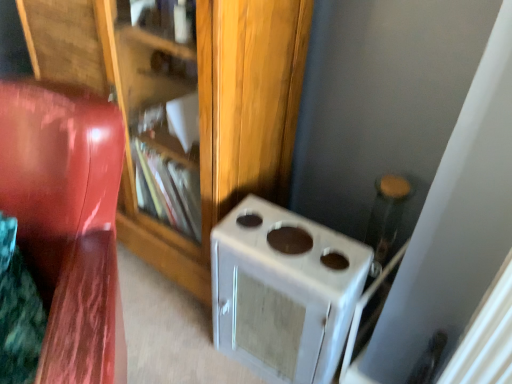
The width and height of the screenshot is (512, 384). I want to click on glossy wood chair at left, so click(67, 221).

This screenshot has height=384, width=512. Describe the element at coordinates (232, 126) in the screenshot. I see `wooden bookshelf at center` at that location.

The width and height of the screenshot is (512, 384). Identify the location of glossy wood chair at left. (67, 221).

From their relative heights in the image, would you say wooden bookshelf at center is taller or shorter than glossy wood chair at left?

Considering their sizes, wooden bookshelf at center has more height than glossy wood chair at left.

Which point is more forward, (140, 249) or (33, 162)?

Point (33, 162)

Is wooden bookshelf at center far away from glossy wood chair at left?

That's not correct — wooden bookshelf at center is a little close to glossy wood chair at left.

You are a GUI agent. You are given a task and a screenshot of the screen. Output one action in this format:
    pyautogui.click(x=<x>, y=<y>)
    Task: Click on the bookshelf that is behind the glossy wood chair at left
    This screenshot has height=384, width=512.
    Given the screenshot: What is the action you would take?
    pyautogui.click(x=232, y=126)

How much distance is there between white matte stove at lower right and wooden bookshelf at center?

white matte stove at lower right is 11.01 inches away from wooden bookshelf at center.

Is white matte stove at lower right positioned with its back to wooden bookshelf at center?

white matte stove at lower right is not turned away from wooden bookshelf at center.

Between white matte stove at lower right and wooden bookshelf at center, which one has smaller size?

white matte stove at lower right is smaller.

At what (x,y) coordinates should I click in order to perform the action: click on bookshelf on the left of white matte stove at lower right. Please return your answer as a coordinate pair (x, y). Looking at the image, I should click on click(232, 126).

The image size is (512, 384). Find the location of `bookshelf lying behind the glossy wood chair at left`. bookshelf lying behind the glossy wood chair at left is located at coordinates (232, 126).

Considering the sizes of objects glossy wood chair at left and wooden bookshelf at center in the image provided, who is wider, glossy wood chair at left or wooden bookshelf at center?

Result: glossy wood chair at left is wider.

From the picture: Could you tell me if glossy wood chair at left is turned towards wooden bookshelf at center?

No, glossy wood chair at left does not turn towards wooden bookshelf at center.

Considering the relative positions of glossy wood chair at left and wooden bookshelf at center in the image provided, is glossy wood chair at left to the right of wooden bookshelf at center from the viewer's perspective?

No.

Which object is more forward, glossy wood chair at left or white matte stove at lower right?

glossy wood chair at left is in front.

Do you think glossy wood chair at left is within white matte stove at lower right, or outside of it?

glossy wood chair at left lies outside white matte stove at lower right.

From a real-world perspective, is glossy wood chair at left positioned under white matte stove at lower right based on gravity?

Incorrect, from a real-world perspective, glossy wood chair at left is higher than white matte stove at lower right.

How different are the orientations of glossy wood chair at left and white matte stove at lower right in degrees?

The angular difference between glossy wood chair at left and white matte stove at lower right is 41.3 degrees.

Which object is further away from the camera, white matte stove at lower right or glossy wood chair at left?

white matte stove at lower right is behind.

Considering the sizes of white matte stove at lower right and glossy wood chair at left in the image, is white matte stove at lower right bigger or smaller than glossy wood chair at left?

In the image, white matte stove at lower right appears to be smaller than glossy wood chair at left.

Which object is wider, white matte stove at lower right or glossy wood chair at left?

With larger width is glossy wood chair at left.

Are white matte stove at lower right and glossy wood chair at left beside each other?

They are not placed beside each other.

Are wooden bookshelf at center and white matte stove at lower right located far from each other?

Actually, wooden bookshelf at center and white matte stove at lower right are a little close together.

Is wooden bookshelf at center facing towards white matte stove at lower right?

No, wooden bookshelf at center is not turned towards white matte stove at lower right.

From the picture: From the image's perspective, which one is positioned lower, wooden bookshelf at center or white matte stove at lower right?

From the image's view, white matte stove at lower right is below.

Find the location of a particular element. furniture on the left of wooden bookshelf at center is located at coordinates (67, 221).

The width and height of the screenshot is (512, 384). I want to click on home appliance below the wooden bookshelf at center (from a real-world perspective), so click(x=284, y=292).

Consider the image. When comparing their distances from wooden bookshelf at center, does glossy wood chair at left or white matte stove at lower right seem closer?

white matte stove at lower right.

Which object lies nearer to the anchor point white matte stove at lower right, wooden bookshelf at center or glossy wood chair at left?

wooden bookshelf at center lies closer to white matte stove at lower right than the other object.

From the image, which object appears to be farther from glossy wood chair at left, wooden bookshelf at center or white matte stove at lower right?

white matte stove at lower right.

Considering their positions, is glossy wood chair at left positioned closer to white matte stove at lower right than wooden bookshelf at center?

wooden bookshelf at center.

Looking at the image, which one is located further to glossy wood chair at left, white matte stove at lower right or wooden bookshelf at center?

white matte stove at lower right is further to glossy wood chair at left.

Considering their positions, is white matte stove at lower right positioned closer to wooden bookshelf at center than glossy wood chair at left?

white matte stove at lower right.

I want to click on bookshelf positioned between glossy wood chair at left and white matte stove at lower right from near to far, so click(232, 126).